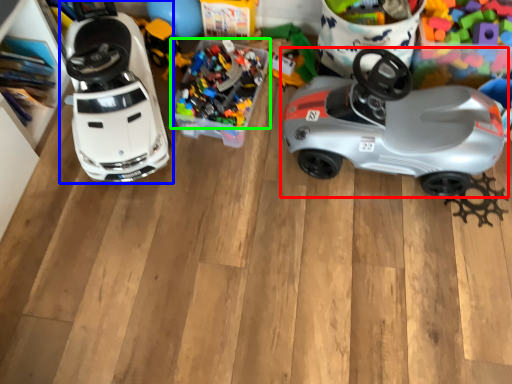
Question: Estimate the real-world distances between objects in this image. Which object is closer to car (highlighted by a red box), toy (highlighted by a blue box) or toy (highlighted by a green box)?

Choices:
 (A) toy
 (B) toy

Answer: (B)